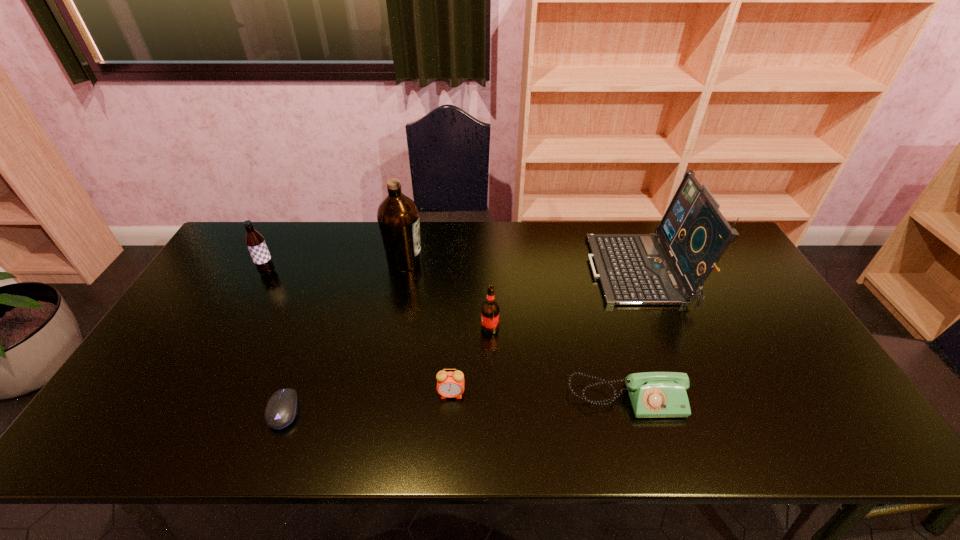
The image size is (960, 540). What are the coordinates of `the sixth object from right to left` in the screenshot? It's located at (282, 407).

Image resolution: width=960 pixels, height=540 pixels. What are the coordinates of `free point located 0.110m on the label of the third object from left to right` in the screenshot? It's located at (457, 261).

This screenshot has height=540, width=960. In order to click on vacant space located on the front-facing side of the laptop computer in this screenshot , I will do `click(501, 272)`.

At what (x,y) coordinates should I click in order to perform the action: click on free space located on the front-facing side of the laptop computer. Please return your answer as a coordinate pair (x, y). Looking at the image, I should click on (532, 272).

Where is `vacant area situated on the front-facing side of the laptop computer`? The width and height of the screenshot is (960, 540). vacant area situated on the front-facing side of the laptop computer is located at coordinates (516, 272).

You are a GUI agent. You are given a task and a screenshot of the screen. Output one action in this format:
    pyautogui.click(x=<x>, y=<y>)
    Task: Click on the free space located on the right of the farther root beer
    This screenshot has height=540, width=960.
    Given the screenshot: What is the action you would take?
    [x=301, y=272]

Where is `free space located on the front of the fourth farthest object`? The image size is (960, 540). free space located on the front of the fourth farthest object is located at coordinates (492, 395).

Identify the location of vacant space located 0.080m on the face of the third shortest object. The width and height of the screenshot is (960, 540). (449, 430).

Identify the location of vacant space located 0.190m on the left of the shortest object. This screenshot has width=960, height=540. (188, 410).

This screenshot has height=540, width=960. Identify the location of olive oil at the far edge. (398, 217).